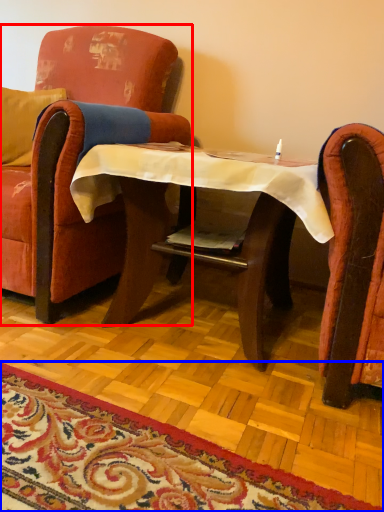
Question: Which object appears farthest to the camera in this image, chair (highlighted by a red box) or mat (highlighted by a blue box)?

Choices:
 (A) chair
 (B) mat

Answer: (A)